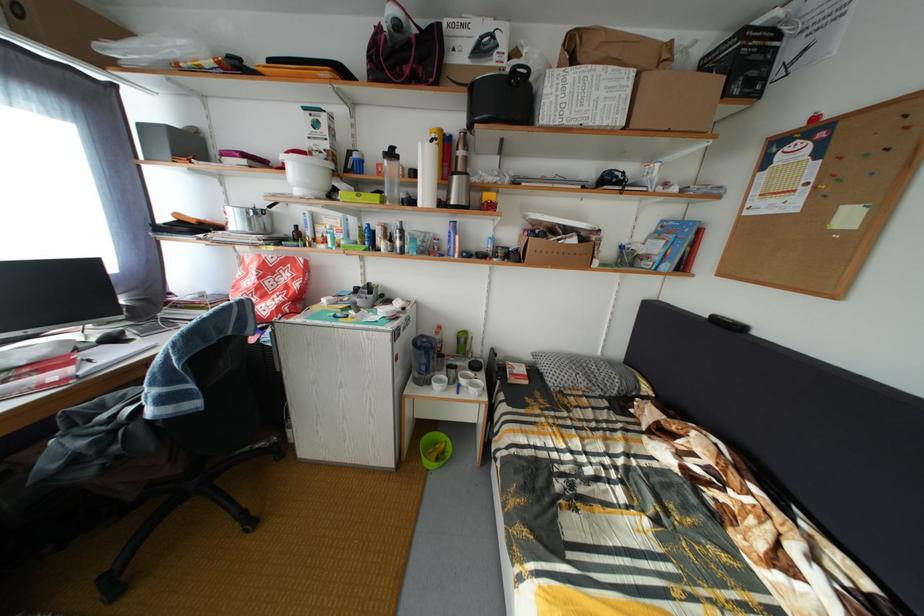
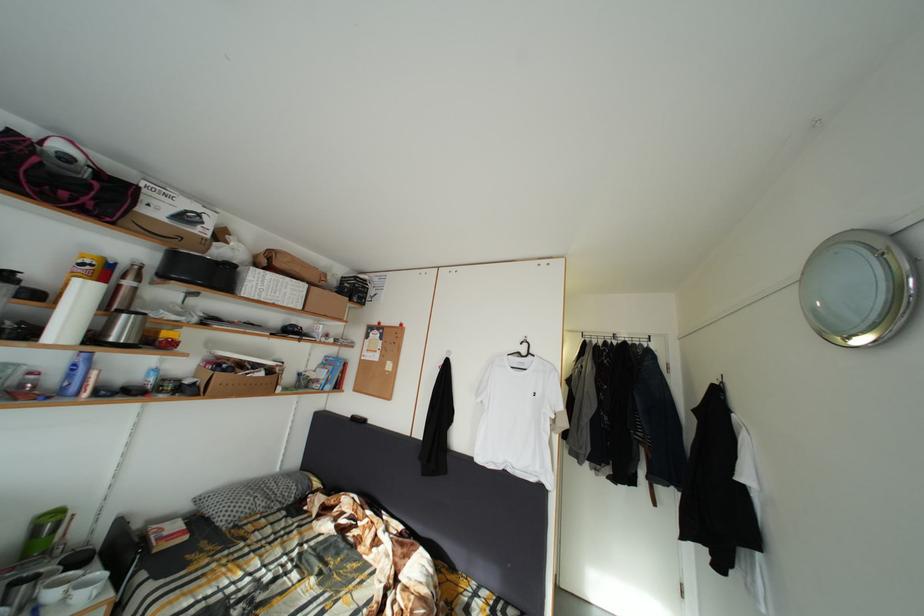
Locate, in the second image, the point that corresponds to point 457,257 in the first image.

(73, 395)